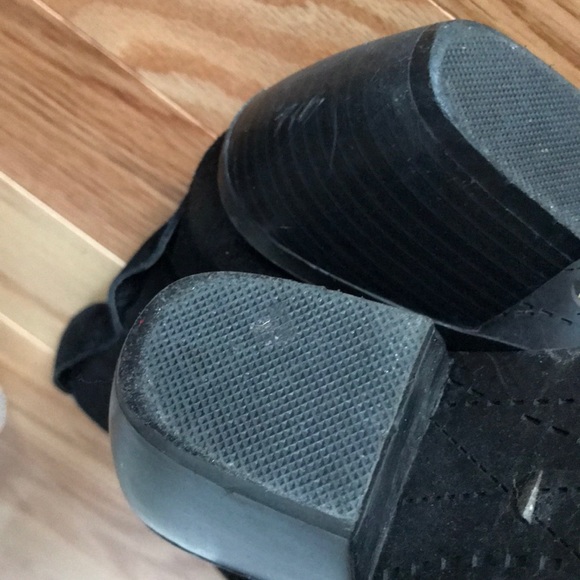
Where is `anti skid pads`? Image resolution: width=580 pixels, height=580 pixels. anti skid pads is located at coordinates (501, 113), (284, 391).